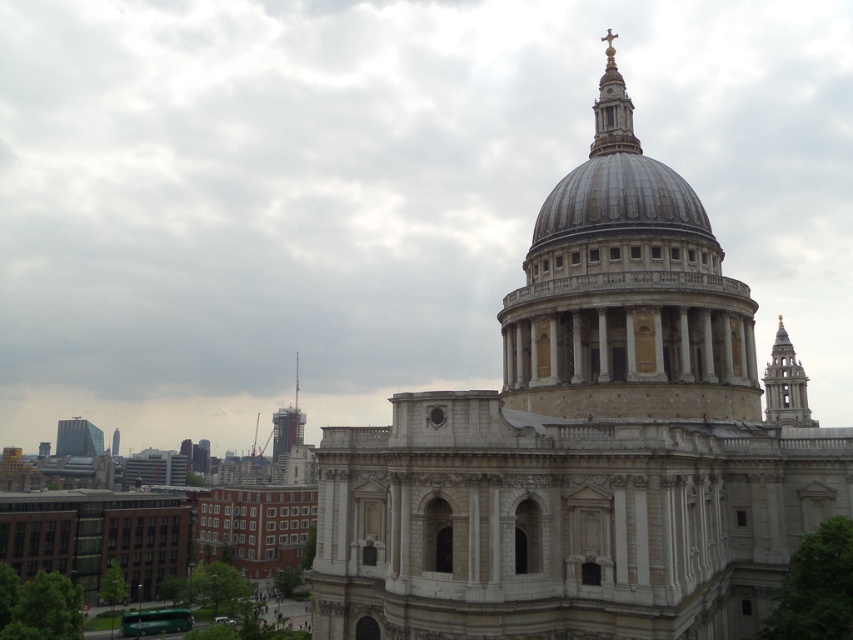
You are a tourist standing in front of St. Paul Cathedral. You notice the beige stone dome at center and the dark gray concrete tower at center. Which structure appears taller from your vantage point?

The beige stone dome at center appears taller than the dark gray concrete tower at center from your vantage point because the beige stone dome at center has a greater height compared to dark gray concrete tower at center.

You are standing in front of St. Paul Cathedral and want to locate the beige stone dome at center. Can you tell me where the point at coordinates point [625,292] is located?

The point at coordinates point [625,292] is located on the beige stone dome at center.

You are a tourist visiting St. Paul Cathedral. You notice the white stone cathedral at center and the gold polished metal cross at upper center. Which object appears bigger in the image?

The white stone cathedral at center is larger in size compared to the gold polished metal cross at upper center, so the cathedral appears bigger in the image.